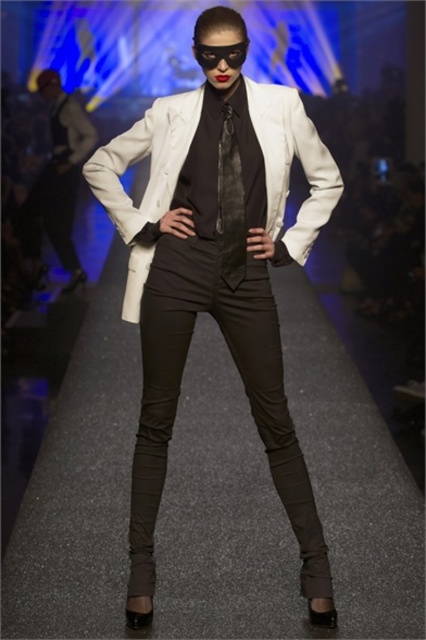
Which is more to the right, black smooth pants at center or matte black dress at left?

From the viewer's perspective, black smooth pants at center appears more on the right side.

Between point (149, 524) and point (57, 230), which one is positioned behind?

The point (57, 230) is more distant.

This screenshot has height=640, width=426. Describe the element at coordinates (244, 387) in the screenshot. I see `black smooth pants at center` at that location.

Where is `black smooth pants at center`? This screenshot has width=426, height=640. black smooth pants at center is located at coordinates (244, 387).

Does white matte blazer at center have a greater width compared to satin black tie at center?

Indeed, white matte blazer at center has a greater width compared to satin black tie at center.

Does white matte blazer at center appear on the left side of satin black tie at center?

Indeed, white matte blazer at center is positioned on the left side of satin black tie at center.

Which is in front, point (261, 138) or point (222, 216)?

Point (261, 138)

Find the location of a particular element. Image resolution: width=426 pixels, height=640 pixels. white matte blazer at center is located at coordinates click(215, 276).

Does black smooth pants at center have a lesser height compared to satin black tie at center?

No, black smooth pants at center is not shorter than satin black tie at center.

Is point (195, 243) positioned in front of point (230, 154)?

No.

At what (x,y) coordinates should I click in order to perform the action: click on black smooth pants at center. Please return your answer as a coordinate pair (x, y). The width and height of the screenshot is (426, 640). Looking at the image, I should click on (244, 387).